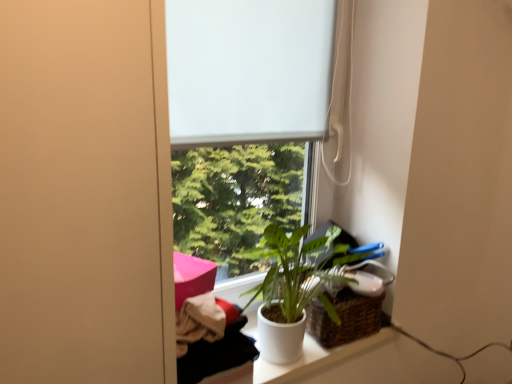
Question: Is white matte window at center taller or shorter than woven brown basket at lower right?

Choices:
 (A) tall
 (B) short

Answer: (A)

Question: From a real-world perspective, is white matte window at center positioned above or below woven brown basket at lower right?

Choices:
 (A) below
 (B) above

Answer: (B)

Question: Which is farther from the white matte window screen at center?

Choices:
 (A) white matte window at center
 (B) woven brown basket at lower right

Answer: (B)

Question: Estimate the real-world distances between objects in this image. Which object is farther from the white matte window at center?

Choices:
 (A) white matte window screen at center
 (B) woven brown basket at lower right

Answer: (B)